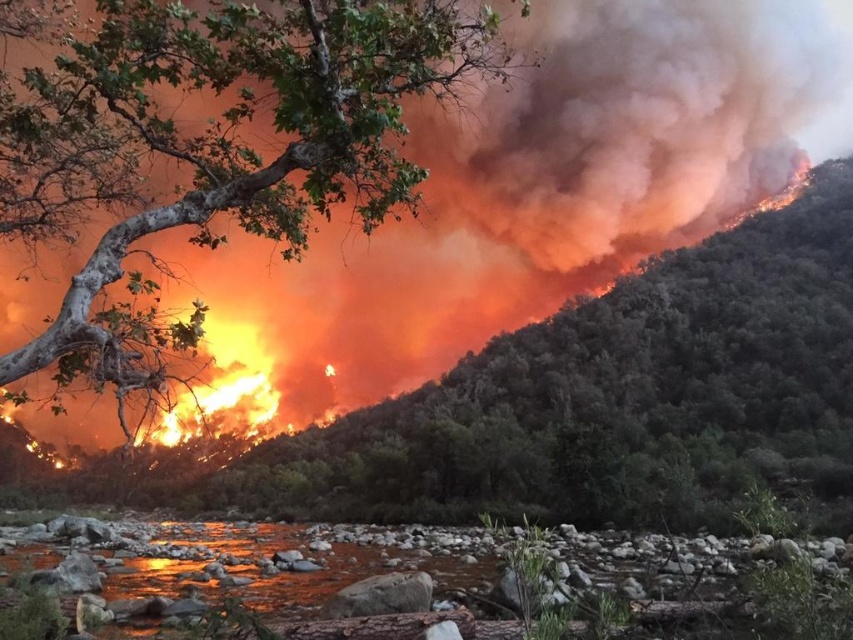
Based on the photo, you are a firefighter trying to reach the green leafy tree at center to assess its condition. Your current position is at the point with coordinates point [572,403]. Is the tree within your immediate vicinity?

The green leafy tree at center is located at point [572,403], so yes, the tree is right at your current position, meaning it is within your immediate vicinity.

You are a firefighter trying to find a safe path to the river. You see two green leafy trees in the image. Which tree is closer to the river? The green leafy tree at center or the green leafy tree at upper left?

The green leafy tree at center is closer to the river because it is positioned to the right of the green leafy tree at upper left, and the river is in the foreground.